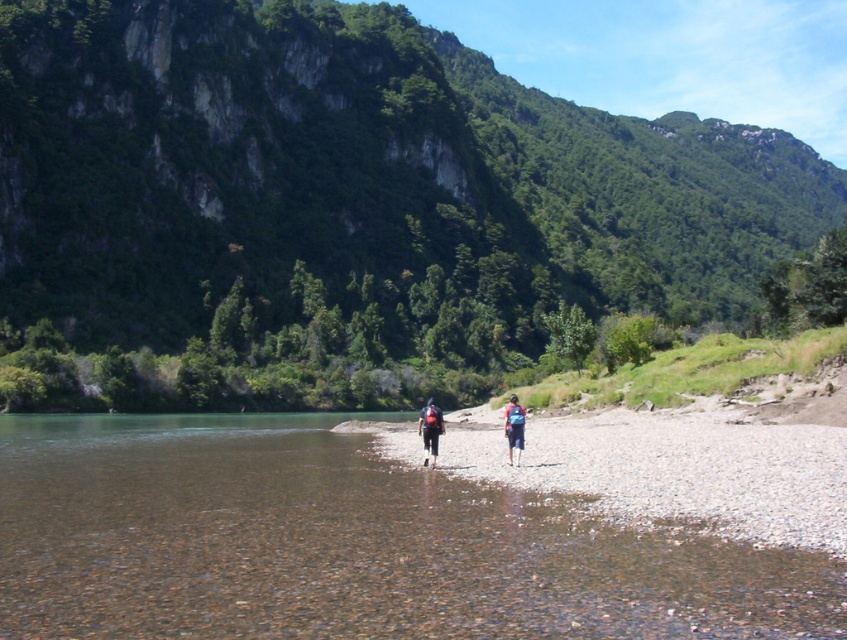
Question: Which object is the closest to the clear water at river center?

Choices:
 (A) blue fabric backpack at center
 (B) matte black backpack at center
 (C) blue fabric backpacks at center

Answer: (B)

Question: In this image, where is matte black backpack at center located relative to blue fabric backpack at center?

Choices:
 (A) above
 (B) below

Answer: (B)

Question: From the image, what is the correct spatial relationship of clear water at river center in relation to matte black backpack at center?

Choices:
 (A) above
 (B) below

Answer: (A)

Question: Which object is closer to the camera taking this photo?

Choices:
 (A) blue fabric backpack at center
 (B) matte black backpack at center
 (C) clear water at river center
 (D) blue fabric backpacks at center

Answer: (C)

Question: Estimate the real-world distances between objects in this image. Which object is farther from the blue fabric backpack at center?

Choices:
 (A) blue fabric backpacks at center
 (B) matte black backpack at center

Answer: (B)

Question: Does clear water at river center have a greater width compared to blue fabric backpack at center?

Choices:
 (A) yes
 (B) no

Answer: (A)